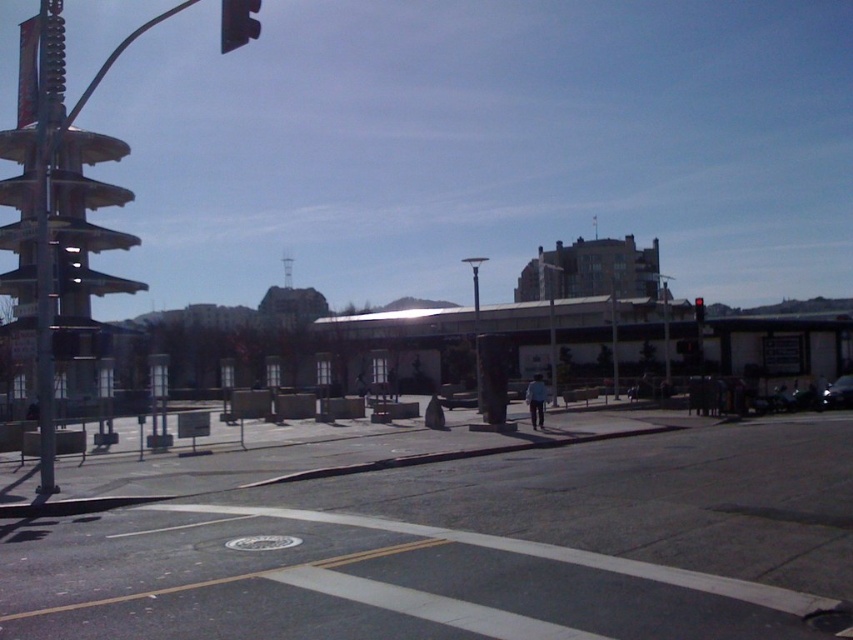
Consider the image. Which is below, metallic pole at left or red matte traffic light at center?

metallic pole at left

The width and height of the screenshot is (853, 640). What do you see at coordinates (45, 221) in the screenshot?
I see `metallic pole at left` at bounding box center [45, 221].

Where is `metallic pole at left`? metallic pole at left is located at coordinates (45, 221).

Does point (59, 42) come in front of point (223, 12)?

No.

Is point (49, 234) more distant than point (223, 20)?

Yes, it is.

This screenshot has height=640, width=853. Identify the location of metallic pole at left. (45, 221).

Based on the photo, between black plastic traffic light at upper left and red matte traffic light at center, which one has less height?

red matte traffic light at center is shorter.

Find the location of `black plastic traffic light at upper left`. black plastic traffic light at upper left is located at coordinates (238, 22).

This screenshot has width=853, height=640. What are the coordinates of `black plastic traffic light at upper left` in the screenshot? It's located at (238, 22).